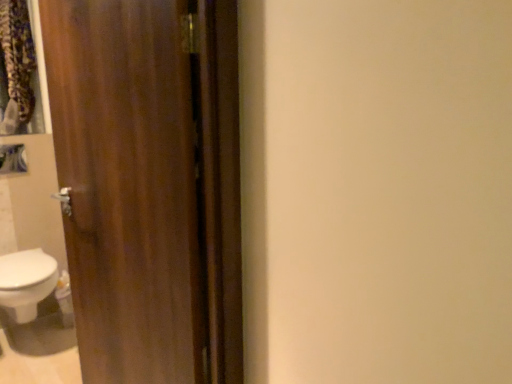
Question: Is white glossy bidet at lower left further to camera compared to wooden door at left?

Choices:
 (A) no
 (B) yes

Answer: (B)

Question: From a real-world perspective, is white glossy bidet at lower left below wooden door at left?

Choices:
 (A) no
 (B) yes

Answer: (B)

Question: Is white glossy bidet at lower left bigger than wooden door at left?

Choices:
 (A) yes
 (B) no

Answer: (B)

Question: From the image's perspective, would you say white glossy bidet at lower left is shown under wooden door at left?

Choices:
 (A) no
 (B) yes

Answer: (B)

Question: From a real-world perspective, is white glossy bidet at lower left located higher than wooden door at left?

Choices:
 (A) yes
 (B) no

Answer: (B)

Question: Can you confirm if white glossy bidet at lower left is shorter than wooden door at left?

Choices:
 (A) no
 (B) yes

Answer: (B)

Question: Could you tell me if wooden door at left is facing white glossy bidet at lower left?

Choices:
 (A) no
 (B) yes

Answer: (A)

Question: From the image's perspective, is wooden door at left over white glossy bidet at lower left?

Choices:
 (A) no
 (B) yes

Answer: (B)

Question: From the image's perspective, is wooden door at left under white glossy bidet at lower left?

Choices:
 (A) yes
 (B) no

Answer: (B)

Question: Can you confirm if wooden door at left is shorter than white glossy bidet at lower left?

Choices:
 (A) yes
 (B) no

Answer: (B)

Question: From a real-world perspective, is wooden door at left under white glossy bidet at lower left?

Choices:
 (A) no
 (B) yes

Answer: (A)

Question: Would you say wooden door at left contains white glossy bidet at lower left?

Choices:
 (A) yes
 (B) no

Answer: (B)

Question: From a real-world perspective, is white glossy bidet at lower left physically located above or below wooden door at left?

Choices:
 (A) above
 (B) below

Answer: (B)